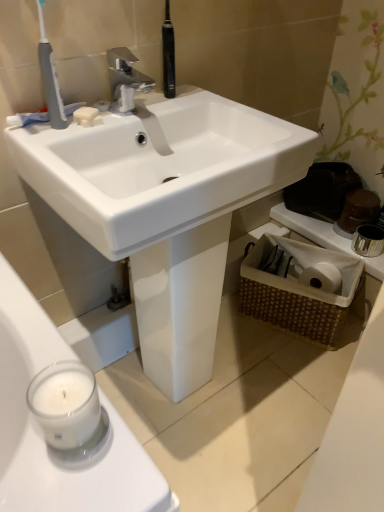
Question: Visually, is gray plastic toothbrush at upper left positioned to the left or to the right of white matte toothpaste at upper left?

Choices:
 (A) right
 (B) left

Answer: (A)

Question: From a real-world perspective, relative to white matte toothpaste at upper left, is gray plastic toothbrush at upper left vertically above or below?

Choices:
 (A) above
 (B) below

Answer: (A)

Question: Which of these objects is positioned farthest from the white matte counter top at right?

Choices:
 (A) white matte toothpaste at upper left
 (B) woven brown basket at lower right
 (C) silver metallic faucet at upper center
 (D) white matte soap at upper left
 (E) gray plastic toothbrush at upper left

Answer: (E)

Question: Which object is positioned closest to the white matte counter top at right?

Choices:
 (A) white matte toothpaste at upper left
 (B) white glossy sink at center
 (C) gray plastic toothbrush at upper left
 (D) woven brown basket at lower right
 (E) white matte soap at upper left

Answer: (D)